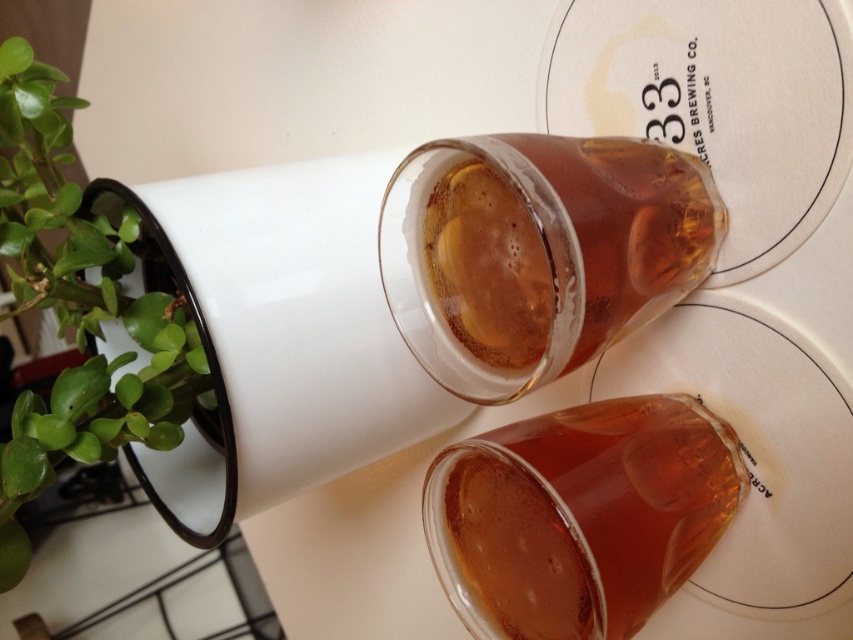
You are at a bar and want to know if the height of the translucent amber liquid at center in the glass is more than half the height of the translucent amber glass at center. Can you determine this based on the information provided?

The translucent amber glass at center is taller than the translucent amber liquid at center, but the exact proportion isn not specified. Therefore, it is impossible to determine if the liquid is more than half the glass height without additional information.

You are at a bar and want to place your phone on the surface between the translucent amber glass at center and the green leafy plant at left. Can you place it closer to the glass than the plant?

The translucent amber glass at center is closer to the viewer than the green leafy plant at left, so placing the phone closer to the glass would mean it is nearer to you, which is possible as long as there is space between them.